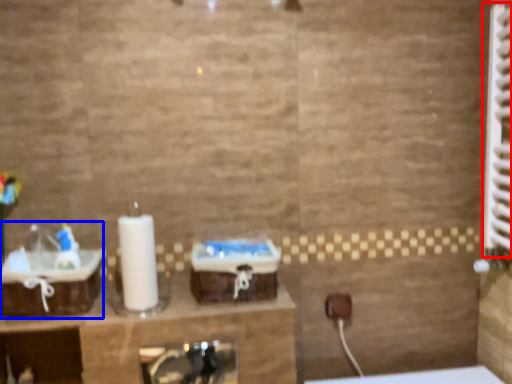
Question: Among these objects, which one is farthest to the camera, radiator (highlighted by a red box) or sink (highlighted by a blue box)?

Choices:
 (A) radiator
 (B) sink

Answer: (B)